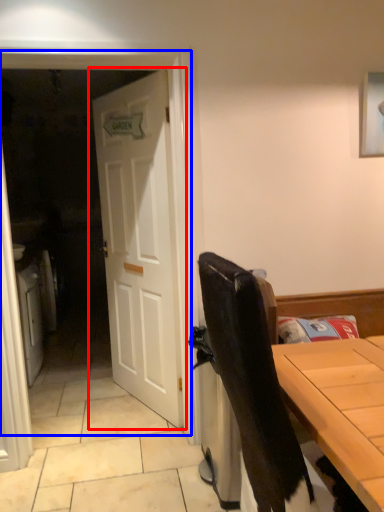
Question: Among these objects, which one is nearest to the camera, door (highlighted by a red box) or screen door (highlighted by a blue box)?

Choices:
 (A) door
 (B) screen door

Answer: (B)